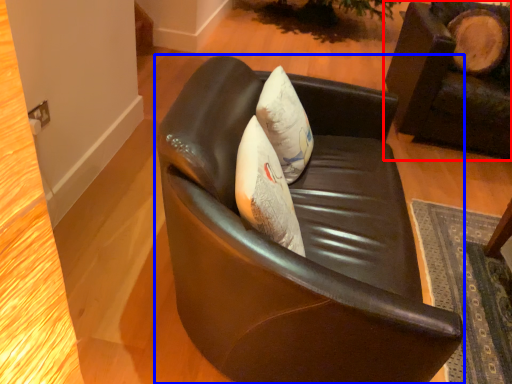
Question: Which object appears closest to the camera in this image, chair (highlighted by a red box) or chair (highlighted by a blue box)?

Choices:
 (A) chair
 (B) chair

Answer: (B)